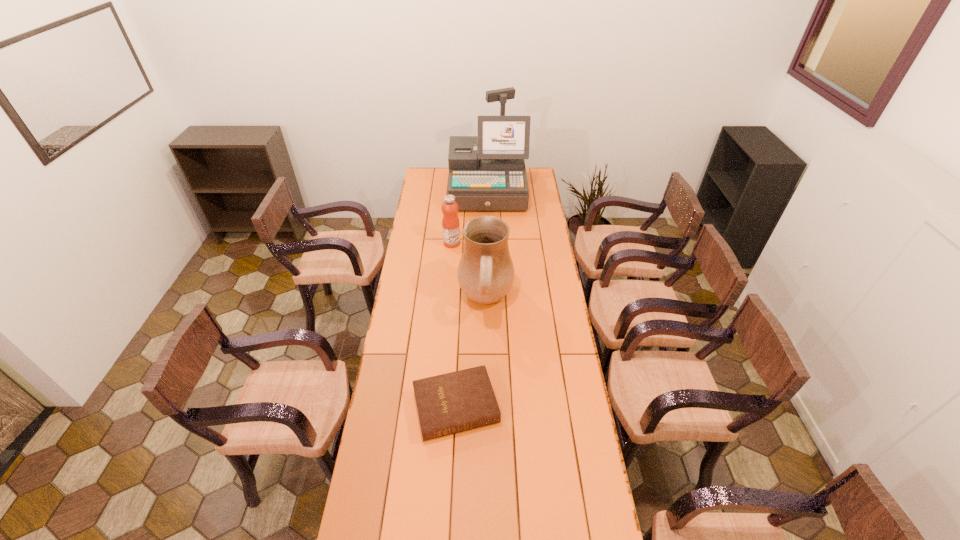
What are the coordinates of `the tallest object` in the screenshot? It's located at (494, 179).

Locate an element on the screen. cash register is located at coordinates (494, 179).

You are a GUI agent. You are given a task and a screenshot of the screen. Output one action in this format:
    pyautogui.click(x=<x>, y=<y>)
    Task: Click on the second tallest object
    This screenshot has height=540, width=960.
    Given the screenshot: What is the action you would take?
    [485, 273]

Find the location of a particular element. The width and height of the screenshot is (960, 540). cream pitcher is located at coordinates (485, 273).

Identify the location of the second farthest object. The width and height of the screenshot is (960, 540). (450, 223).

At what (x,y) coordinates should I click in order to perform the action: click on fruit juice. Please return your answer as a coordinate pair (x, y). Image resolution: width=960 pixels, height=540 pixels. Looking at the image, I should click on (450, 223).

Image resolution: width=960 pixels, height=540 pixels. I want to click on the nearest object, so click(450, 403).

Where is `the shortest object`? Image resolution: width=960 pixels, height=540 pixels. the shortest object is located at coordinates (450, 403).

Identify the location of free space located on the customer-facing side of the cash register. This screenshot has height=540, width=960. (489, 235).

In order to click on free space located 0.200m at the spout of the cream pitcher in this screenshot , I will do `click(415, 301)`.